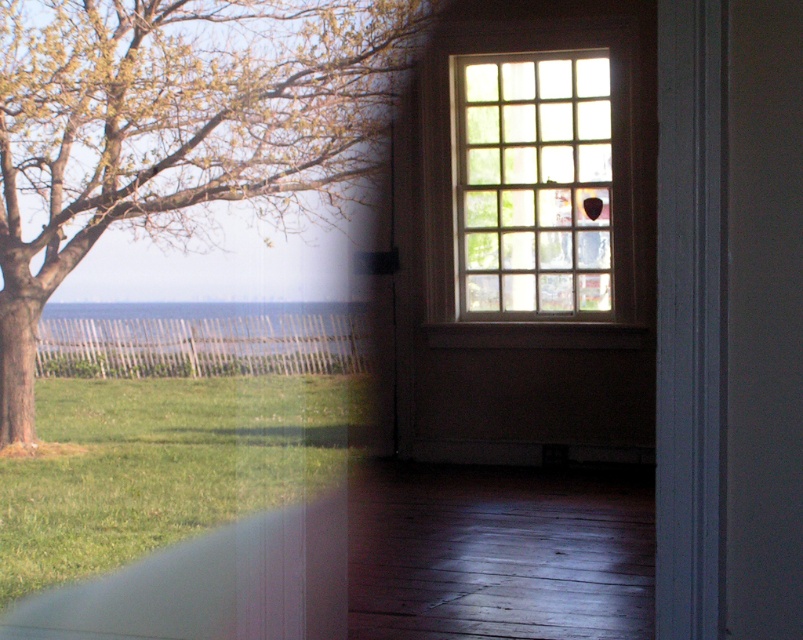
Question: Is green leafy tree at left bigger than clear blue water at center?

Choices:
 (A) no
 (B) yes

Answer: (B)

Question: Which point is farther from the camera taking this photo?

Choices:
 (A) (585, 280)
 (B) (355, 339)
 (C) (19, 259)

Answer: (A)

Question: Considering the real-world distances, which object is farthest from the green leafy tree at left?

Choices:
 (A) clear glass window at center
 (B) clear blue water at center

Answer: (A)

Question: Does clear glass window at center have a smaller size compared to clear blue water at center?

Choices:
 (A) yes
 (B) no

Answer: (B)

Question: Which point is farther to the camera?

Choices:
 (A) (279, 323)
 (B) (601, 108)

Answer: (B)

Question: Is green leafy tree at left wider than clear blue water at center?

Choices:
 (A) yes
 (B) no

Answer: (A)